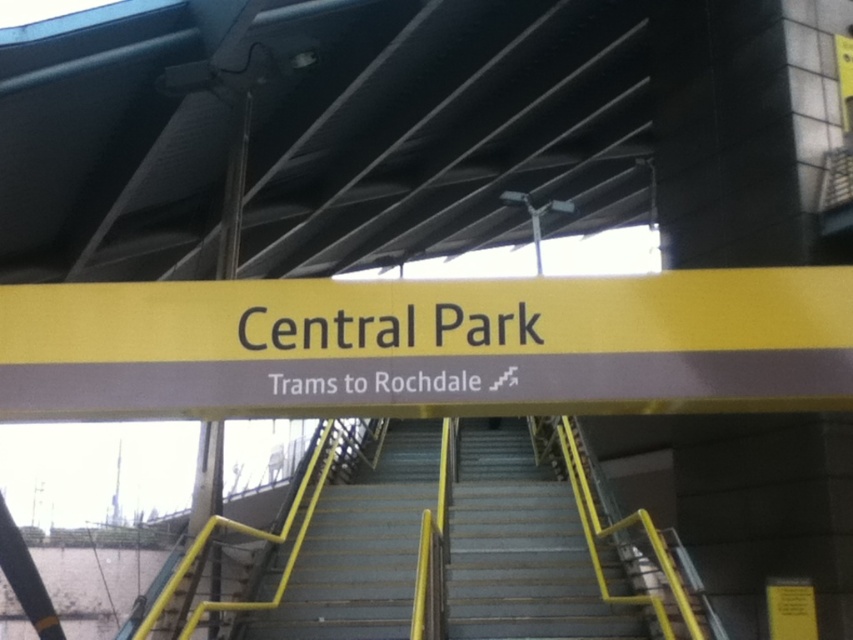
Question: Is gray concrete stairs at center thinner than metallic gray stairs at center?

Choices:
 (A) no
 (B) yes

Answer: (A)

Question: Can you confirm if gray concrete stairs at center is positioned below metallic gray stairs at center?

Choices:
 (A) yes
 (B) no

Answer: (A)

Question: Which point is closer to the camera?

Choices:
 (A) (553, 563)
 (B) (346, 595)

Answer: (B)

Question: Which point is closer to the camera taking this photo?

Choices:
 (A) (618, 566)
 (B) (381, 456)

Answer: (A)

Question: Is gray concrete stairs at center smaller than metallic gray stairs at center?

Choices:
 (A) yes
 (B) no

Answer: (A)